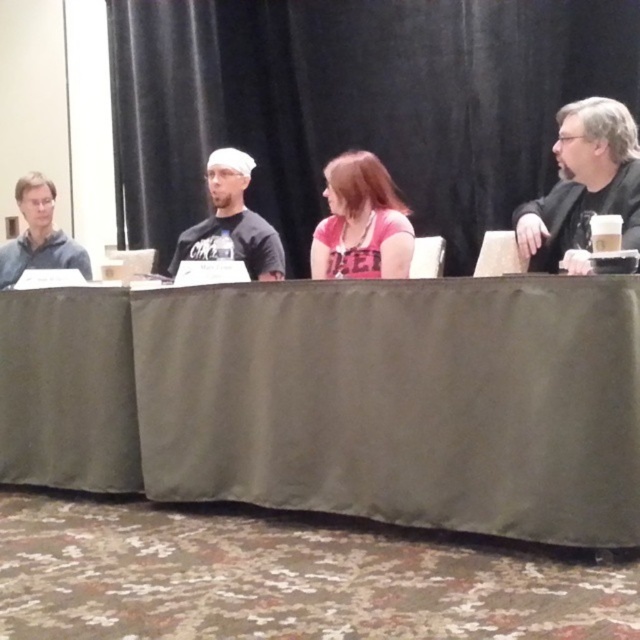
You are standing at the back of the room facing the table. Which of the two points, point [528,243] or point [26,253], is closer to you?

Point [26,253] is closer to you because it is behind point [528,243].

What is the coordinate of the green fabric table at center?

The green fabric table at center is located at coordinate point (339,400).